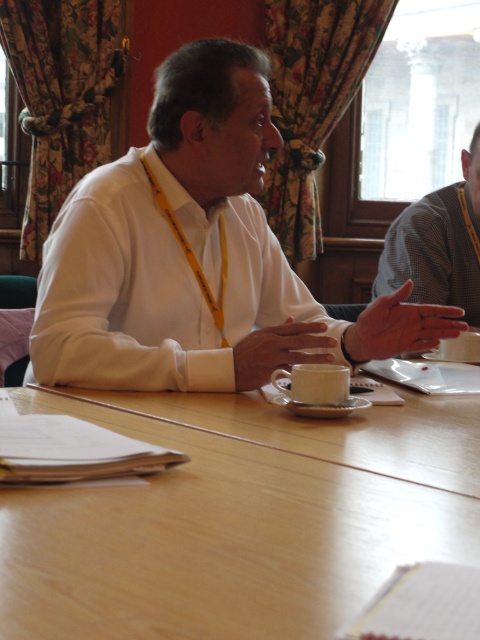
Can you confirm if wooden table at center is smaller than white matte cup at center?

No, wooden table at center is not smaller than white matte cup at center.

You are a GUI agent. You are given a task and a screenshot of the screen. Output one action in this format:
    pyautogui.click(x=<x>, y=<y>)
    Task: Click on the wooden table at center
    This screenshot has height=640, width=480.
    Given the screenshot: What is the action you would take?
    pyautogui.click(x=331, y=429)

The width and height of the screenshot is (480, 640). I want to click on wooden table at center, so click(331, 429).

Can you confirm if light wood table at center is shorter than white matte shirt at center?

Indeed, light wood table at center has a lesser height compared to white matte shirt at center.

Can you confirm if light wood table at center is positioned below white matte shirt at center?

Yes, light wood table at center is below white matte shirt at center.

Does point (151, 394) come in front of point (68, 328)?

That is True.

The image size is (480, 640). I want to click on light wood table at center, so click(239, 516).

Which is behind, point (201, 465) or point (410, 448)?

Point (410, 448)

Is the position of light wood table at center more distant than that of wooden table at center?

No, light wood table at center is closer to the viewer.

Which is behind, point (435, 483) or point (323, 458)?

The point (323, 458) is behind.

Find the location of `light wood table at center`. light wood table at center is located at coordinates (239, 516).